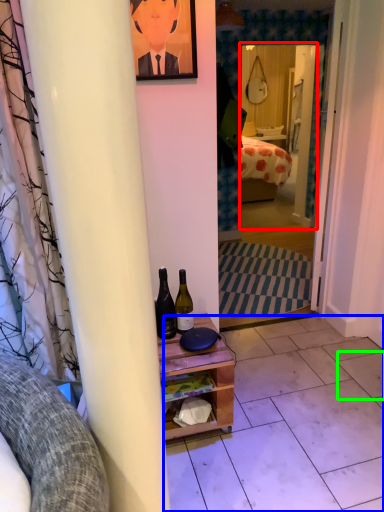
Question: Considering the real-world distances, which object is closest to mirror (highlighted by a red box)? tile (highlighted by a blue box) or tile (highlighted by a green box).

Choices:
 (A) tile
 (B) tile

Answer: (A)